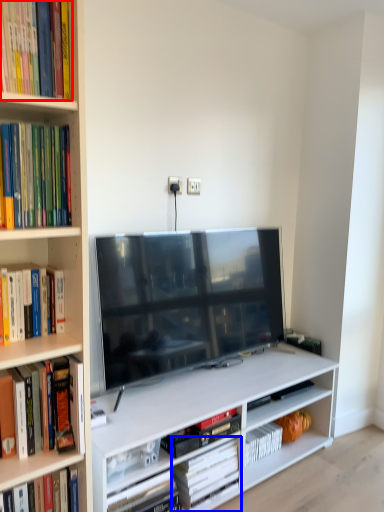
Question: Which object appears closest to the camera in this image, book (highlighted by a red box) or book (highlighted by a blue box)?

Choices:
 (A) book
 (B) book

Answer: (A)